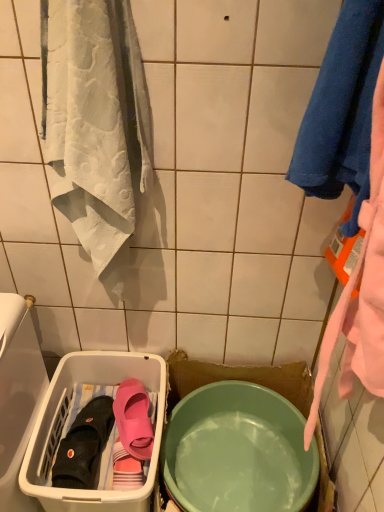
The image size is (384, 512). What do you see at coordinates (134, 419) in the screenshot? I see `pink rubber slipper at lower left, which is the 1th footwear in right-to-left order` at bounding box center [134, 419].

What is the approximate width of white plastic laundry basket at lower left?

The width of white plastic laundry basket at lower left is 44.42 centimeters.

Describe the element at coordinates (74, 418) in the screenshot. I see `white plastic laundry basket at lower left` at that location.

You are a GUI agent. You are given a task and a screenshot of the screen. Output one action in this format:
    pyautogui.click(x=<x>, y=<y>)
    Task: Click on the blue soft towel at upper right
    The width and height of the screenshot is (384, 512).
    Given the screenshot: What is the action you would take?
    pyautogui.click(x=342, y=111)

Locate an element on the screen. The image size is (384, 512). matte green bowl at center is located at coordinates (238, 451).

Does point (319, 169) lie in front of point (146, 430)?

Yes.

From a real-world perspective, which is physically below, blue soft towel at upper right or pink rubber slipper at lower left, which is the 2th footwear in left-to-right order?

From a 3D spatial view, pink rubber slipper at lower left, which is the 2th footwear in left-to-right order, is below.

Is blue soft towel at upper right outside of pink rubber slipper at lower left, which is the 2th footwear in left-to-right order?

Yes, blue soft towel at upper right is outside of pink rubber slipper at lower left, which is the 2th footwear in left-to-right order.

Based on the photo, looking at the image, does blue soft towel at upper right seem bigger or smaller compared to pink rubber slipper at lower left, which is the 2th footwear in left-to-right order?

Result: blue soft towel at upper right is bigger than pink rubber slipper at lower left, which is the 2th footwear in left-to-right order.

Is point (91, 433) positioned before point (134, 378)?

That is True.

Is there a large distance between black rubber boot at lower left, marked as the 2th footwear in a right-to-left arrangement, and pink rubber slipper at lower left, which is the 1th footwear in right-to-left order?

No, black rubber boot at lower left, marked as the 2th footwear in a right-to-left arrangement, is not far away from pink rubber slipper at lower left, which is the 1th footwear in right-to-left order.

From a real-world perspective, relative to pink rubber slipper at lower left, which is the 1th footwear in right-to-left order, is black rubber boot at lower left, the first footwear when ordered from left to right, vertically above or below?

Clearly, from a real-world perspective, black rubber boot at lower left, the first footwear when ordered from left to right, is below pink rubber slipper at lower left, which is the 1th footwear in right-to-left order.

Considering the positions of objects black rubber boot at lower left, the first footwear when ordered from left to right, and pink rubber slipper at lower left, which is the 2th footwear in left-to-right order, in the image provided, who is more to the right, black rubber boot at lower left, the first footwear when ordered from left to right, or pink rubber slipper at lower left, which is the 2th footwear in left-to-right order,?

pink rubber slipper at lower left, which is the 2th footwear in left-to-right order, is more to the right.

Is white plastic laundry basket at lower left in front of or behind black rubber boot at lower left, marked as the 2th footwear in a right-to-left arrangement, in the image?

In the image, white plastic laundry basket at lower left appears in front of black rubber boot at lower left, marked as the 2th footwear in a right-to-left arrangement.

What's the angular difference between white plastic laundry basket at lower left and black rubber boot at lower left, marked as the 2th footwear in a right-to-left arrangement,'s facing directions?

The angular difference between white plastic laundry basket at lower left and black rubber boot at lower left, marked as the 2th footwear in a right-to-left arrangement, is 12.9 degrees.

Does white plastic laundry basket at lower left have a lesser height compared to black rubber boot at lower left, the first footwear when ordered from left to right?

In fact, white plastic laundry basket at lower left may be taller than black rubber boot at lower left, the first footwear when ordered from left to right.

Consider the image. Looking at the image, does white plastic laundry basket at lower left seem bigger or smaller compared to black rubber boot at lower left, marked as the 2th footwear in a right-to-left arrangement?

Considering their sizes, white plastic laundry basket at lower left takes up more space than black rubber boot at lower left, marked as the 2th footwear in a right-to-left arrangement.

Which of these two, matte green bowl at center or white plastic laundry basket at lower left, is bigger?

white plastic laundry basket at lower left is bigger.

What's the angular difference between matte green bowl at center and white plastic laundry basket at lower left's facing directions?

The angle between the facing direction of matte green bowl at center and the facing direction of white plastic laundry basket at lower left is 5.26e-06 degrees.

From a real-world perspective, between matte green bowl at center and white plastic laundry basket at lower left, who is vertically higher?

matte green bowl at center is physically above.

Considering the relative positions of matte green bowl at center and white plastic laundry basket at lower left in the image provided, is matte green bowl at center to the left or to the right of white plastic laundry basket at lower left?

matte green bowl at center is positioned on white plastic laundry basket at lower left's right side.

From the image's perspective, which one is positioned lower, blue soft towel at upper right or matte green bowl at center?

matte green bowl at center.

Would you say blue soft towel at upper right is outside matte green bowl at center?

Yes, blue soft towel at upper right is not within matte green bowl at center.

From their relative heights in the image, would you say blue soft towel at upper right is taller or shorter than matte green bowl at center?

blue soft towel at upper right is taller than matte green bowl at center.

Does blue soft towel at upper right appear on the left side of matte green bowl at center?

Incorrect, blue soft towel at upper right is not on the left side of matte green bowl at center.

Find the location of a particular element. The width and height of the screenshot is (384, 512). laundry basket on the left of pink rubber slipper at lower left, which is the 2th footwear in left-to-right order is located at coordinates (74, 418).

Is white plastic laundry basket at lower left facing towards pink rubber slipper at lower left, which is the 1th footwear in right-to-left order?

No, white plastic laundry basket at lower left does not turn towards pink rubber slipper at lower left, which is the 1th footwear in right-to-left order.

Is white plastic laundry basket at lower left not within pink rubber slipper at lower left, which is the 1th footwear in right-to-left order?

Absolutely, white plastic laundry basket at lower left is external to pink rubber slipper at lower left, which is the 1th footwear in right-to-left order.

Considering the positions of objects white plastic laundry basket at lower left and blue soft towel at upper right in the image provided, who is more to the right, white plastic laundry basket at lower left or blue soft towel at upper right?

blue soft towel at upper right is more to the right.

Who is shorter, white plastic laundry basket at lower left or blue soft towel at upper right?

With less height is blue soft towel at upper right.

Based on their sizes in the image, would you say white plastic laundry basket at lower left is bigger or smaller than blue soft towel at upper right?

Considering their sizes, white plastic laundry basket at lower left takes up more space than blue soft towel at upper right.

Identify the location of towel above the white plastic laundry basket at lower left (from the image's perspective). 342,111.

Identify the location of towel above the pink rubber slipper at lower left, which is the 1th footwear in right-to-left order (from a real-world perspective). Image resolution: width=384 pixels, height=512 pixels. (342, 111).

Where is `footwear that appears below the pink rubber slipper at lower left, which is the 2th footwear in left-to-right order (from a real-world perspective)`? footwear that appears below the pink rubber slipper at lower left, which is the 2th footwear in left-to-right order (from a real-world perspective) is located at coordinates (84, 446).

Looking at this image, looking at the image, which one is located further to pink rubber slipper at lower left, which is the 1th footwear in right-to-left order, matte green bowl at center or blue soft towel at upper right?

Among the two, blue soft towel at upper right is located further to pink rubber slipper at lower left, which is the 1th footwear in right-to-left order.

Based on their spatial positions, is matte green bowl at center or blue soft towel at upper right closer to black rubber boot at lower left, the first footwear when ordered from left to right?

Among the two, matte green bowl at center is located nearer to black rubber boot at lower left, the first footwear when ordered from left to right.

From the picture: Based on their spatial positions, is black rubber boot at lower left, marked as the 2th footwear in a right-to-left arrangement, or blue soft towel at upper right further from pink rubber slipper at lower left, which is the 2th footwear in left-to-right order?

Among the two, blue soft towel at upper right is located further to pink rubber slipper at lower left, which is the 2th footwear in left-to-right order.

When comparing their distances from pink rubber slipper at lower left, which is the 2th footwear in left-to-right order, does white plastic laundry basket at lower left or blue soft towel at upper right seem closer?

white plastic laundry basket at lower left.

Which object lies further to the anchor point pink rubber slipper at lower left, which is the 1th footwear in right-to-left order, blue soft towel at upper right or matte green bowl at center?

blue soft towel at upper right is positioned further to the anchor pink rubber slipper at lower left, which is the 1th footwear in right-to-left order.

When comparing their distances from black rubber boot at lower left, marked as the 2th footwear in a right-to-left arrangement, does matte green bowl at center or pink rubber slipper at lower left, which is the 1th footwear in right-to-left order, seem further?

matte green bowl at center lies further to black rubber boot at lower left, marked as the 2th footwear in a right-to-left arrangement, than the other object.

Based on their spatial positions, is blue soft towel at upper right or black rubber boot at lower left, the first footwear when ordered from left to right, closer to matte green bowl at center?

black rubber boot at lower left, the first footwear when ordered from left to right, lies closer to matte green bowl at center than the other object.

Which object lies further to the anchor point matte green bowl at center, white plastic laundry basket at lower left or black rubber boot at lower left, marked as the 2th footwear in a right-to-left arrangement?

Among the two, black rubber boot at lower left, marked as the 2th footwear in a right-to-left arrangement, is located further to matte green bowl at center.

Where is `footwear that lies between pink rubber slipper at lower left, which is the 2th footwear in left-to-right order, and white plastic laundry basket at lower left from top to bottom`? The width and height of the screenshot is (384, 512). footwear that lies between pink rubber slipper at lower left, which is the 2th footwear in left-to-right order, and white plastic laundry basket at lower left from top to bottom is located at coordinates (84, 446).

Image resolution: width=384 pixels, height=512 pixels. Find the location of `laundry basket located between black rubber boot at lower left, marked as the 2th footwear in a right-to-left arrangement, and matte green bowl at center in the left-right direction`. laundry basket located between black rubber boot at lower left, marked as the 2th footwear in a right-to-left arrangement, and matte green bowl at center in the left-right direction is located at coordinates (74, 418).

At what (x,y) coordinates should I click in order to perform the action: click on footwear between blue soft towel at upper right and black rubber boot at lower left, marked as the 2th footwear in a right-to-left arrangement, vertically. Please return your answer as a coordinate pair (x, y). The width and height of the screenshot is (384, 512). Looking at the image, I should click on (134, 419).

Locate an element on the screen. This screenshot has height=512, width=384. mixing bowl between blue soft towel at upper right and white plastic laundry basket at lower left vertically is located at coordinates (238, 451).